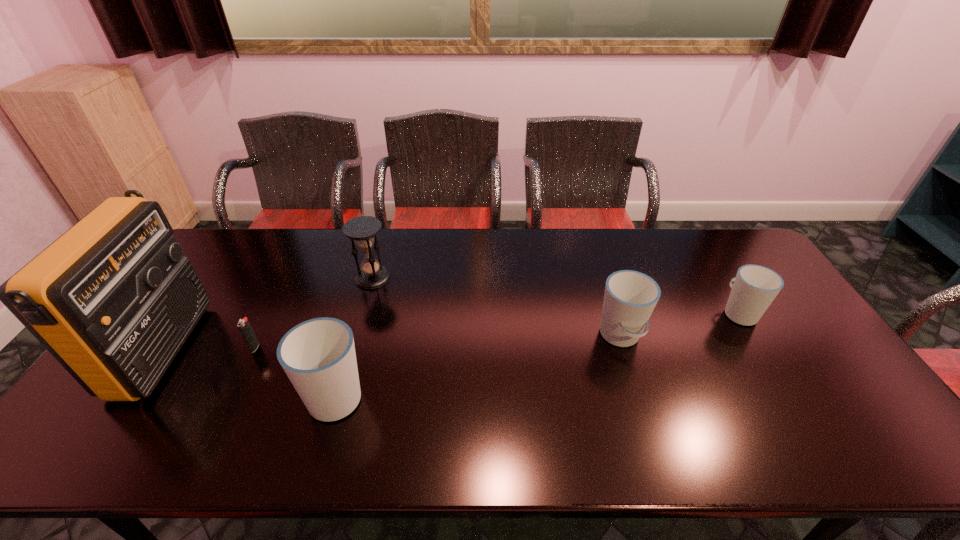
Image resolution: width=960 pixels, height=540 pixels. In order to click on the nearest cup in this screenshot , I will do `click(318, 355)`.

Identify the location of the second object from right to left. (630, 297).

Identify the location of the second cup from right to left. The image size is (960, 540). (630, 297).

Identify the location of the fifth tallest object. (755, 287).

I want to click on the rightmost cup, so click(x=755, y=287).

You are a GUI agent. You are given a task and a screenshot of the screen. Output one action in this format:
    pyautogui.click(x=<x>, y=<y>)
    Task: Click on the farthest object
    The image size is (960, 540).
    Given the screenshot: What is the action you would take?
    pyautogui.click(x=362, y=230)

Locate an element on the screen. The height and width of the screenshot is (540, 960). the second object from left to right is located at coordinates (244, 326).

This screenshot has height=540, width=960. I want to click on igniter, so click(x=244, y=326).

You are a GUI agent. You are given a task and a screenshot of the screen. Output one action in this format:
    pyautogui.click(x=<x>, y=<y>)
    Task: Click on the radio receiver
    The image size is (960, 540).
    Given the screenshot: What is the action you would take?
    pyautogui.click(x=113, y=299)

What are the coordinates of `the leftmost object` in the screenshot? It's located at (113, 299).